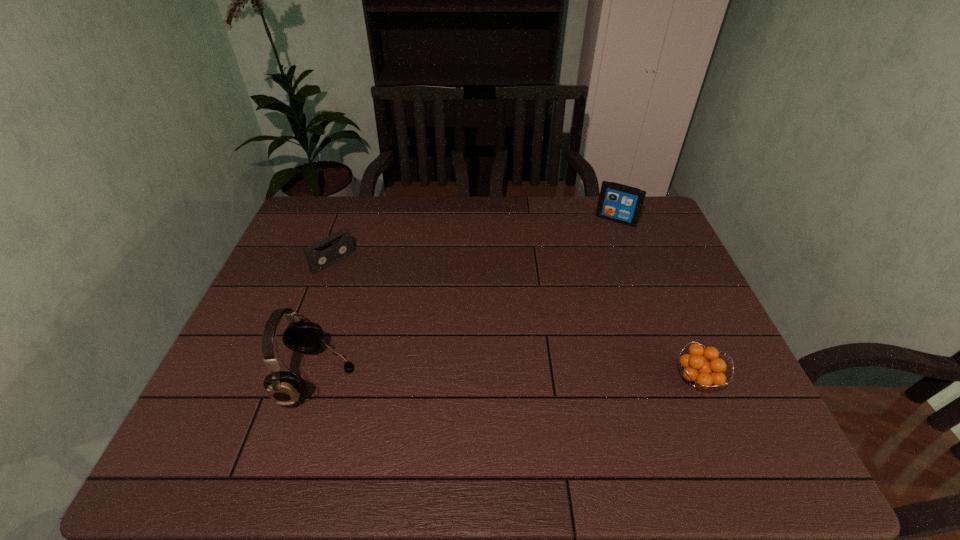
Where is `object situated at the far right corner`? The height and width of the screenshot is (540, 960). object situated at the far right corner is located at coordinates (617, 202).

The height and width of the screenshot is (540, 960). Find the location of `object located in the near right corner section of the desktop`. object located in the near right corner section of the desktop is located at coordinates (701, 374).

The image size is (960, 540). Identify the location of free space at the far edge. (531, 215).

Where is `blank space at the left edge of the desktop`? blank space at the left edge of the desktop is located at coordinates (258, 352).

You are a GUI agent. You are given a task and a screenshot of the screen. Output one action in this format:
    pyautogui.click(x=<x>, y=<y>)
    Task: Click on the blank space at the right edge of the desktop
    The height and width of the screenshot is (540, 960).
    Given the screenshot: What is the action you would take?
    pyautogui.click(x=641, y=246)

In the image, there is a desktop. Find the location of `vacant space at the far right corner`. vacant space at the far right corner is located at coordinates (618, 228).

Locate an element on the screen. vacant area that lies between the tallest object and the videotape is located at coordinates (325, 319).

The image size is (960, 540). Identify the location of blank region between the videotape and the orange fruit. (516, 321).

Where is `unoccupied area between the third shortest object and the videotape`? Image resolution: width=960 pixels, height=540 pixels. unoccupied area between the third shortest object and the videotape is located at coordinates (474, 241).

Locate an element on the screen. blank region between the tallest object and the orange fruit is located at coordinates (508, 379).